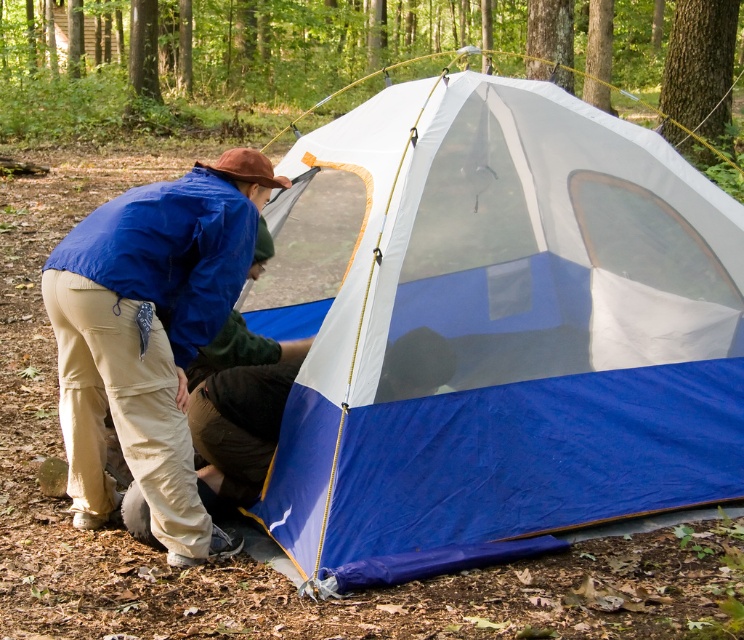
You are planning to set up a tent in a wooded area. You have a blue tarpaulin tent at center and a blue fabric jacket at lower left. Which item is bigger in size?

The blue tarpaulin tent at center is larger in size compared to the blue fabric jacket at lower left.

You are standing in the wooded area and see the blue tarpaulin tent at center and the blue fabric jacket at lower left. Which object is higher in position?

The blue tarpaulin tent at center is above the blue fabric jacket at lower left, so the tent is higher.